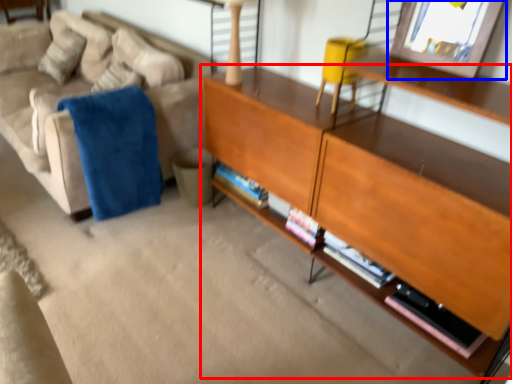
Question: Which of the following is the farthest to the observer, shelf (highlighted by a red box) or picture frame (highlighted by a blue box)?

Choices:
 (A) shelf
 (B) picture frame

Answer: (B)